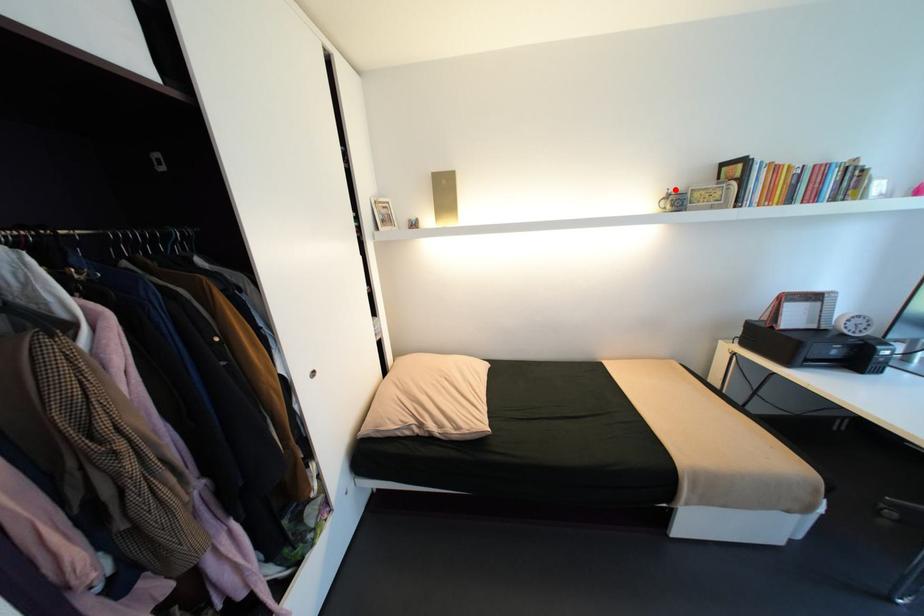
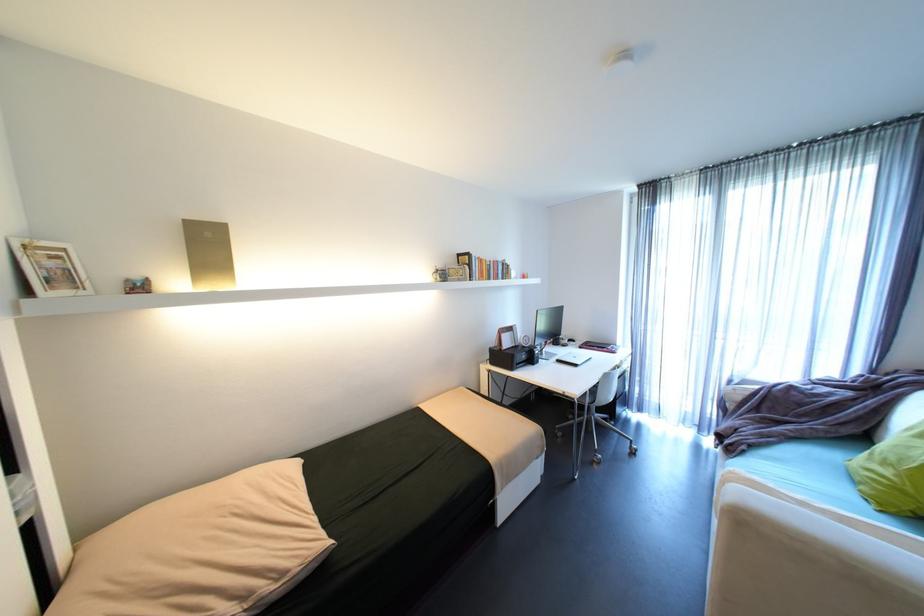
Locate, in the second image, the point that corresponds to the highlighted location in the first image.

(444, 267)